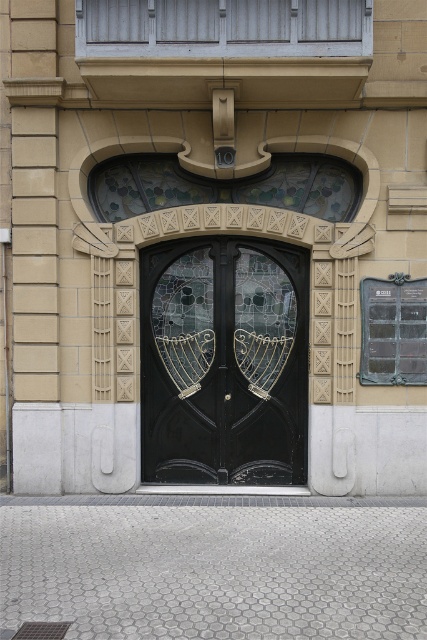
You are standing in front of the entrance door and want to locate the point at coordinates (224,362). Where exactly would you find this point on the door?

The point at coordinates (224,362) is located on the stained glass doors at center.

You are standing in front of the entrance door and want to touch both points mentioned. Which point should you reach first, point at coordinate (216,339) or point at coordinate (366,358)?

You should reach point at coordinate (216,339) first because it is closer to you than point at coordinate (366,358).